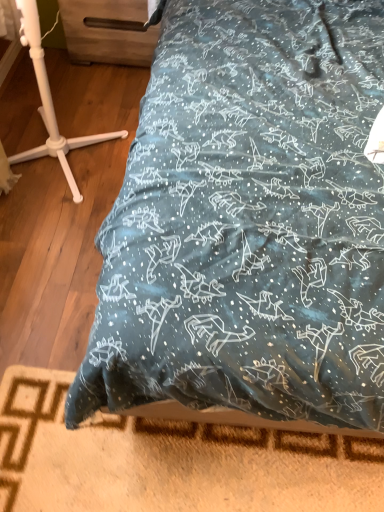
Question: From a real-world perspective, relative to white plastic tripod at left, is wooden drawer at upper left vertically above or below?

Choices:
 (A) below
 (B) above

Answer: (A)

Question: Relative to white plastic tripod at left, is wooden drawer at upper left in front or behind?

Choices:
 (A) behind
 (B) front

Answer: (A)

Question: Which object is positioned closest to the white plastic tripod at left?

Choices:
 (A) wooden bed frame at lower center
 (B) teal fabric bed at center
 (C) wooden drawer at upper left

Answer: (C)

Question: Estimate the real-world distances between objects in this image. Which object is farther from the wooden bed frame at lower center?

Choices:
 (A) teal fabric bed at center
 (B) white plastic tripod at left
 (C) wooden drawer at upper left

Answer: (C)